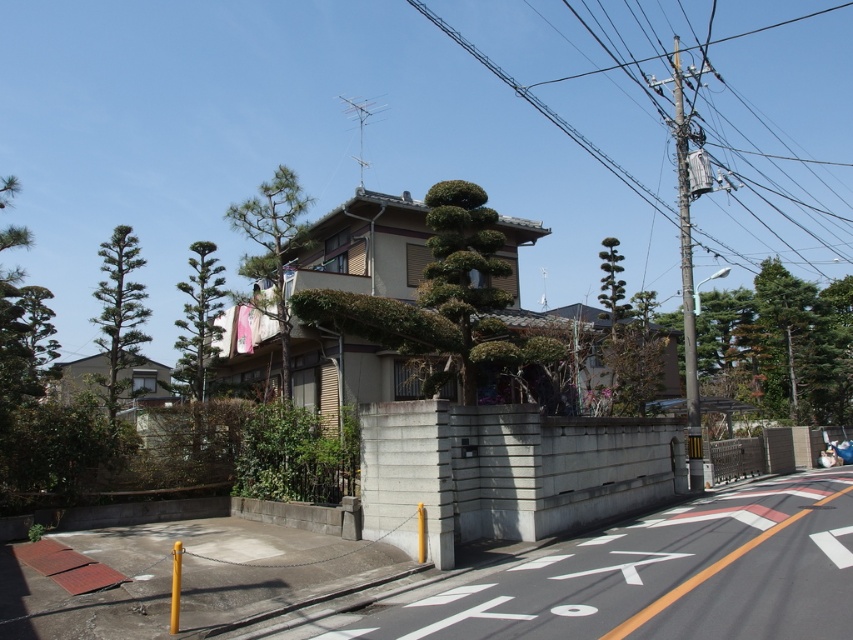
Question: Where is green leafy bush at center located in relation to green needle-like tree at left in the image?

Choices:
 (A) right
 (B) left

Answer: (A)

Question: Among these points, which one is farthest from the camera?

Choices:
 (A) (287, 236)
 (B) (461, 330)
 (C) (613, 292)

Answer: (C)

Question: Which of the following is the farthest from the observer?

Choices:
 (A) (283, 227)
 (B) (129, 228)
 (C) (461, 268)
 (D) (608, 236)

Answer: (D)

Question: Which point appears farthest from the camera in this image?

Choices:
 (A) (811, 148)
 (B) (125, 387)

Answer: (A)

Question: Can you confirm if metallic wire at upper center is wider than green textured tree at upper center?

Choices:
 (A) no
 (B) yes

Answer: (B)

Question: In this image, where is metallic wire at upper center located relative to green textured tree at center?

Choices:
 (A) left
 (B) right

Answer: (B)